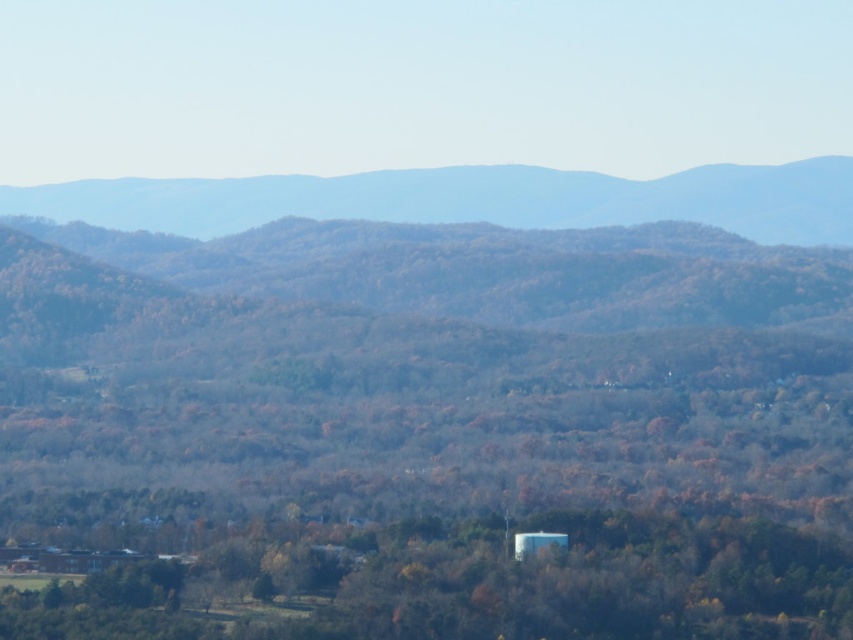
Can you confirm if green matte tree at center is positioned below greenish-brown forested mountain at upper center?

Correct, green matte tree at center is located below greenish-brown forested mountain at upper center.

Can you confirm if green matte tree at center is shorter than greenish-brown forested mountain at upper center?

No, green matte tree at center is not shorter than greenish-brown forested mountain at upper center.

Who is more forward, (782,618) or (404,195)?

Point (404,195)

Where is `green matte tree at center`? Image resolution: width=853 pixels, height=640 pixels. green matte tree at center is located at coordinates (579, 582).